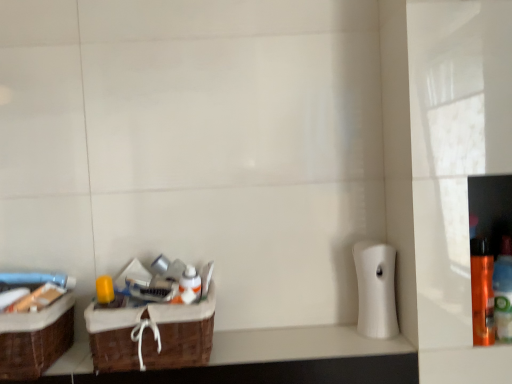
Question: From a real-world perspective, is white matte toilet paper at right on orange glossy spray can at right, which is the second bottle from right to left?

Choices:
 (A) yes
 (B) no

Answer: (A)

Question: Considering the relative positions of white matte toilet paper at right and orange glossy spray can at right, which is the second bottle from right to left, in the image provided, is white matte toilet paper at right behind orange glossy spray can at right, which is the second bottle from right to left,?

Choices:
 (A) yes
 (B) no

Answer: (A)

Question: Can you confirm if white matte toilet paper at right is smaller than orange glossy spray can at right, which is counted as the 1th bottle, starting from the left?

Choices:
 (A) no
 (B) yes

Answer: (A)

Question: Can you confirm if white matte toilet paper at right is positioned to the left of orange glossy spray can at right, which is counted as the 1th bottle, starting from the left?

Choices:
 (A) yes
 (B) no

Answer: (A)

Question: Does white matte toilet paper at right have a greater width compared to orange glossy spray can at right, which is counted as the 1th bottle, starting from the left?

Choices:
 (A) no
 (B) yes

Answer: (B)

Question: Is white glossy bottle at center to the left or to the right of brown woven basket at lower left, which is the second box from left to right, in the image?

Choices:
 (A) left
 (B) right

Answer: (B)

Question: Is white glossy bottle at center taller or shorter than brown woven basket at lower left, the 1th box in the right-to-left sequence?

Choices:
 (A) tall
 (B) short

Answer: (B)

Question: Is point (186, 268) positioned closer to the camera than point (165, 317)?

Choices:
 (A) closer
 (B) farther

Answer: (B)

Question: Is white glossy bottle at center wider or thinner than brown woven basket at lower left, which is the second box from left to right?

Choices:
 (A) thin
 (B) wide

Answer: (A)

Question: Is brown woven basket at left, positioned as the 1th box in left-to-right order, bigger or smaller than brown woven basket at lower left?

Choices:
 (A) small
 (B) big

Answer: (B)

Question: Would you say brown woven basket at left, positioned as the 1th box in left-to-right order, is inside or outside brown woven basket at lower left?

Choices:
 (A) outside
 (B) inside

Answer: (A)

Question: From the image's perspective, is brown woven basket at left, acting as the 2th box starting from the right, positioned above or below brown woven basket at lower left?

Choices:
 (A) above
 (B) below

Answer: (A)

Question: Is brown woven basket at left, acting as the 2th box starting from the right, wider or thinner than brown woven basket at lower left?

Choices:
 (A) wide
 (B) thin

Answer: (A)

Question: Considering their positions, is orange glossy spray can at right, which is the second bottle from right to left, located in front of or behind white glossy bottle at center?

Choices:
 (A) front
 (B) behind

Answer: (A)

Question: Is orange glossy spray can at right, which is the second bottle from right to left, wider or thinner than white glossy bottle at center?

Choices:
 (A) wide
 (B) thin

Answer: (A)